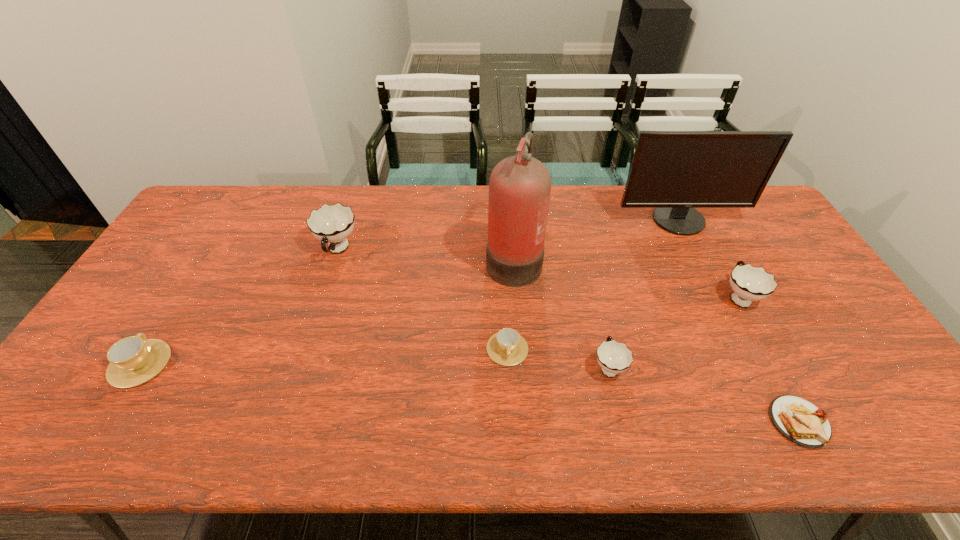
Where is `vacant area that satisfies the following two spatial constraints: 1. with the handle on the side of the sandwich; 2. on the right side of the second shortest object`? This screenshot has height=540, width=960. vacant area that satisfies the following two spatial constraints: 1. with the handle on the side of the sandwich; 2. on the right side of the second shortest object is located at coordinates (511, 422).

This screenshot has width=960, height=540. I want to click on blank space that satisfies the following two spatial constraints: 1. at the nozzle of the beige sandwich; 2. on the right side of the fire extinguisher, so click(526, 422).